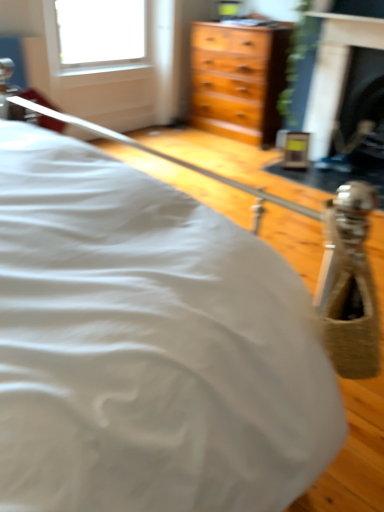
This screenshot has width=384, height=512. Describe the element at coordinates (335, 72) in the screenshot. I see `black marble fireplace at upper right, the second fireplace positioned from the right` at that location.

The image size is (384, 512). I want to click on black marble fireplace at upper right, which appears as the first fireplace when viewed from the left, so click(x=335, y=72).

Locate an element on the screen. The image size is (384, 512). black glass fireplace at upper right, the 1th fireplace positioned from the right is located at coordinates pos(360,99).

Describe the element at coordinates (360, 99) in the screenshot. The width and height of the screenshot is (384, 512). I see `black glass fireplace at upper right, the 1th fireplace positioned from the right` at that location.

Locate an element on the screen. The height and width of the screenshot is (512, 384). black marble fireplace at upper right, which appears as the first fireplace when viewed from the left is located at coordinates (335, 72).

Which object is positioned more to the right, black glass fireplace at upper right, which is the second fireplace from left to right, or black marble fireplace at upper right, which appears as the first fireplace when viewed from the left?

From the viewer's perspective, black glass fireplace at upper right, which is the second fireplace from left to right, appears more on the right side.

Is black glass fireplace at upper right, the 1th fireplace positioned from the right, closer to the viewer compared to black marble fireplace at upper right, which appears as the first fireplace when viewed from the left?

No, it is not.

Considering the positions of points (341, 139) and (333, 36), is point (341, 139) closer to camera compared to point (333, 36)?

No, (341, 139) is behind (333, 36).

From the image's perspective, which is above, black glass fireplace at upper right, which is the second fireplace from left to right, or black marble fireplace at upper right, the second fireplace positioned from the right?

From the image's view, black marble fireplace at upper right, the second fireplace positioned from the right, is above.

From a real-world perspective, is black glass fireplace at upper right, which is the second fireplace from left to right, on top of black marble fireplace at upper right, which appears as the first fireplace when viewed from the left?

No.

Is black glass fireplace at upper right, the 1th fireplace positioned from the right, wider or thinner than black marble fireplace at upper right, which appears as the first fireplace when viewed from the left?

In the image, black glass fireplace at upper right, the 1th fireplace positioned from the right, appears to be wider than black marble fireplace at upper right, which appears as the first fireplace when viewed from the left.

Is black glass fireplace at upper right, which is the second fireplace from left to right, shorter than black marble fireplace at upper right, which appears as the first fireplace when viewed from the left?

Indeed, black glass fireplace at upper right, which is the second fireplace from left to right, has a lesser height compared to black marble fireplace at upper right, which appears as the first fireplace when viewed from the left.

In terms of size, does black glass fireplace at upper right, the 1th fireplace positioned from the right, appear bigger or smaller than black marble fireplace at upper right, the second fireplace positioned from the right?

black glass fireplace at upper right, the 1th fireplace positioned from the right, is bigger than black marble fireplace at upper right, the second fireplace positioned from the right.

Is black glass fireplace at upper right, which is the second fireplace from left to right, inside or outside of black marble fireplace at upper right, the second fireplace positioned from the right?

black glass fireplace at upper right, which is the second fireplace from left to right, cannot be found inside black marble fireplace at upper right, the second fireplace positioned from the right.

Is black glass fireplace at upper right, the 1th fireplace positioned from the right, not near black marble fireplace at upper right, the second fireplace positioned from the right?

No, black glass fireplace at upper right, the 1th fireplace positioned from the right, is not far away from black marble fireplace at upper right, the second fireplace positioned from the right.

Could you tell me if black glass fireplace at upper right, the 1th fireplace positioned from the right, is turned towards black marble fireplace at upper right, the second fireplace positioned from the right?

Yes, black glass fireplace at upper right, the 1th fireplace positioned from the right, is aimed at black marble fireplace at upper right, the second fireplace positioned from the right.

How different are the orientations of black glass fireplace at upper right, the 1th fireplace positioned from the right, and black marble fireplace at upper right, which appears as the first fireplace when viewed from the left, in degrees?

The angle between the facing direction of black glass fireplace at upper right, the 1th fireplace positioned from the right, and the facing direction of black marble fireplace at upper right, which appears as the first fireplace when viewed from the left, is 2.11 degrees.

Where is `fireplace below the black marble fireplace at upper right, which appears as the first fireplace when viewed from the left (from a real-world perspective)`? fireplace below the black marble fireplace at upper right, which appears as the first fireplace when viewed from the left (from a real-world perspective) is located at coordinates (360, 99).

Which is more to the left, black marble fireplace at upper right, the second fireplace positioned from the right, or black glass fireplace at upper right, the 1th fireplace positioned from the right?

From the viewer's perspective, black marble fireplace at upper right, the second fireplace positioned from the right, appears more on the left side.

Between black marble fireplace at upper right, the second fireplace positioned from the right, and black glass fireplace at upper right, the 1th fireplace positioned from the right, which one is positioned behind?

Positioned behind is black glass fireplace at upper right, the 1th fireplace positioned from the right.

Is point (345, 63) less distant than point (346, 119)?

Yes.

From the image's perspective, is black marble fireplace at upper right, the second fireplace positioned from the right, on top of black glass fireplace at upper right, which is the second fireplace from left to right?

Yes, from the image's perspective, black marble fireplace at upper right, the second fireplace positioned from the right, is above black glass fireplace at upper right, which is the second fireplace from left to right.

In the scene shown: From a real-world perspective, is black marble fireplace at upper right, which appears as the first fireplace when viewed from the left, physically below black glass fireplace at upper right, which is the second fireplace from left to right?

No, from a real-world perspective, black marble fireplace at upper right, which appears as the first fireplace when viewed from the left, is not under black glass fireplace at upper right, which is the second fireplace from left to right.

In the scene shown: Considering the sizes of objects black marble fireplace at upper right, which appears as the first fireplace when viewed from the left, and black glass fireplace at upper right, the 1th fireplace positioned from the right, in the image provided, who is wider, black marble fireplace at upper right, which appears as the first fireplace when viewed from the left, or black glass fireplace at upper right, the 1th fireplace positioned from the right,?

With larger width is black glass fireplace at upper right, the 1th fireplace positioned from the right.

Is black marble fireplace at upper right, which appears as the first fireplace when viewed from the left, taller than black glass fireplace at upper right, the 1th fireplace positioned from the right?

Yes, black marble fireplace at upper right, which appears as the first fireplace when viewed from the left, is taller than black glass fireplace at upper right, the 1th fireplace positioned from the right.

Is black marble fireplace at upper right, the second fireplace positioned from the right, smaller than black glass fireplace at upper right, the 1th fireplace positioned from the right?

Correct, black marble fireplace at upper right, the second fireplace positioned from the right, occupies less space than black glass fireplace at upper right, the 1th fireplace positioned from the right.

Is black marble fireplace at upper right, the second fireplace positioned from the right, not within black glass fireplace at upper right, the 1th fireplace positioned from the right?

Yes, black marble fireplace at upper right, the second fireplace positioned from the right, is located beyond the bounds of black glass fireplace at upper right, the 1th fireplace positioned from the right.

Is black marble fireplace at upper right, which appears as the first fireplace when viewed from the left, next to black glass fireplace at upper right, the 1th fireplace positioned from the right?

No, black marble fireplace at upper right, which appears as the first fireplace when viewed from the left, is not touching black glass fireplace at upper right, the 1th fireplace positioned from the right.

Is black marble fireplace at upper right, the second fireplace positioned from the right, oriented towards black glass fireplace at upper right, the 1th fireplace positioned from the right?

Yes, black marble fireplace at upper right, the second fireplace positioned from the right, is oriented towards black glass fireplace at upper right, the 1th fireplace positioned from the right.

How different are the orientations of black marble fireplace at upper right, the second fireplace positioned from the right, and black glass fireplace at upper right, the 1th fireplace positioned from the right, in degrees?

The facing directions of black marble fireplace at upper right, the second fireplace positioned from the right, and black glass fireplace at upper right, the 1th fireplace positioned from the right, are 2.11 degrees apart.

Locate an element on the screen. This screenshot has width=384, height=512. fireplace below the black marble fireplace at upper right, the second fireplace positioned from the right (from the image's perspective) is located at coordinates (360, 99).

Locate an element on the screen. fireplace on the left of black glass fireplace at upper right, which is the second fireplace from left to right is located at coordinates (335, 72).

Locate an element on the screen. Image resolution: width=384 pixels, height=512 pixels. fireplace located in front of the black glass fireplace at upper right, the 1th fireplace positioned from the right is located at coordinates (335, 72).